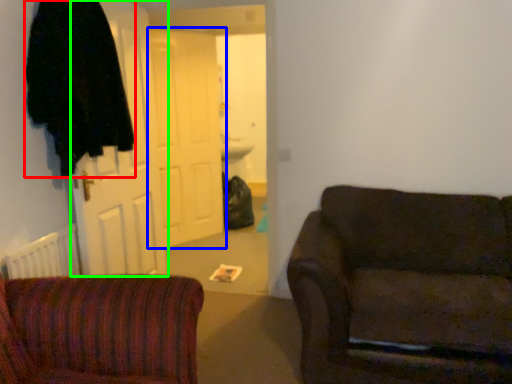
Question: Considering the real-world distances, which object is farthest from robe (highlighted by a red box)? door (highlighted by a blue box) or door (highlighted by a green box)?

Choices:
 (A) door
 (B) door

Answer: (A)